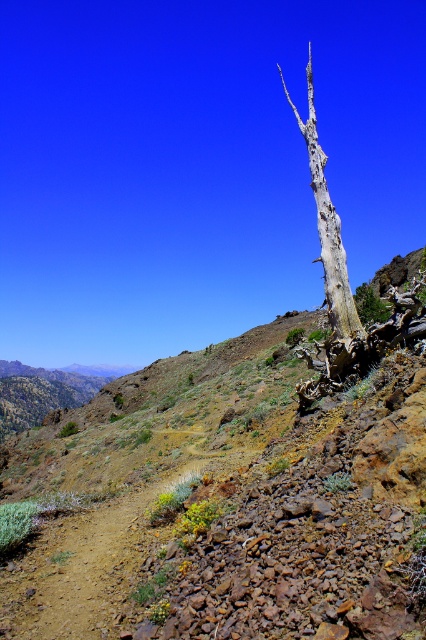
Between grayish-brown bark tree trunk at right and dead wood at upper right, which one appears on the left side from the viewer's perspective?

dead wood at upper right

Can you confirm if grayish-brown bark tree trunk at right is positioned below dead wood at upper right?

No, grayish-brown bark tree trunk at right is not below dead wood at upper right.

Describe the element at coordinates (331, 257) in the screenshot. Image resolution: width=426 pixels, height=640 pixels. I see `grayish-brown bark tree trunk at right` at that location.

Locate an element on the screen. The width and height of the screenshot is (426, 640). grayish-brown bark tree trunk at right is located at coordinates (331, 257).